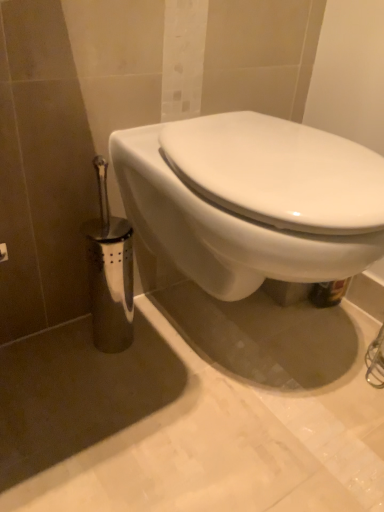
I want to click on white glossy toilet at center, so click(251, 200).

Image resolution: width=384 pixels, height=512 pixels. Describe the element at coordinates (251, 200) in the screenshot. I see `white glossy toilet at center` at that location.

I want to click on white glossy toilet at center, so click(x=251, y=200).